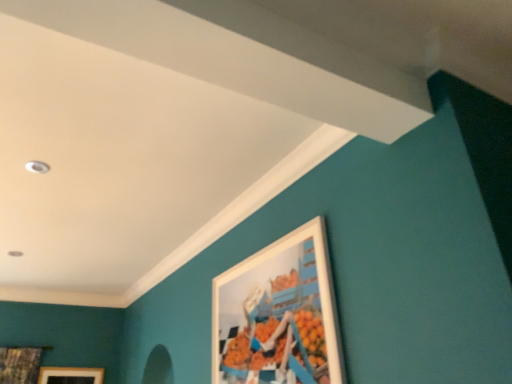
You are a GUI agent. You are given a task and a screenshot of the screen. Output one action in this format:
    pyautogui.click(x=<x>, y=<y>)
    Task: Click on the white matte picture frame at upper right
    The image size is (512, 384).
    Given the screenshot: What is the action you would take?
    pyautogui.click(x=278, y=314)

Measure the distance between point (214,340) and camera.

Point (214,340) is 2.48 meters away from camera.

Image resolution: width=512 pixels, height=384 pixels. What do you see at coordinates (278, 314) in the screenshot?
I see `white matte picture frame at upper right` at bounding box center [278, 314].

At what (x,y) coordinates should I click in order to perform the action: click on white matte picture frame at upper right. Please return your answer as a coordinate pair (x, y). Looking at the image, I should click on (278, 314).